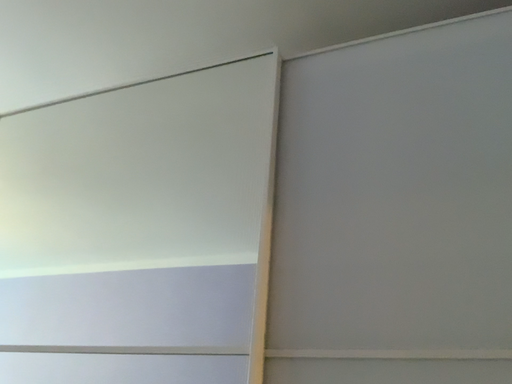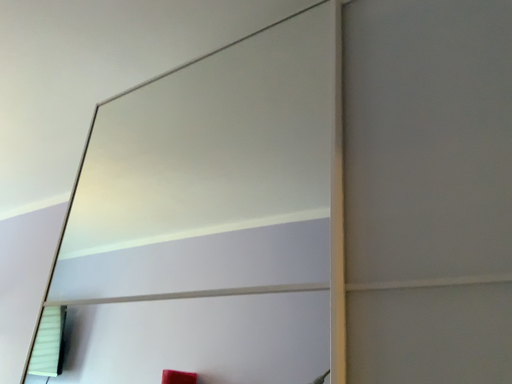
Question: How did the camera likely rotate when shooting the video?

Choices:
 (A) rotated downward
 (B) rotated upward

Answer: (A)